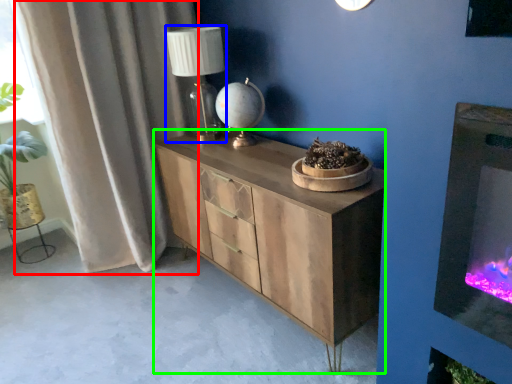
Question: Which is nearer to the curtain (highlighted by a red box)? table lamp (highlighted by a blue box) or chest of drawers (highlighted by a green box).

Choices:
 (A) table lamp
 (B) chest of drawers

Answer: (A)